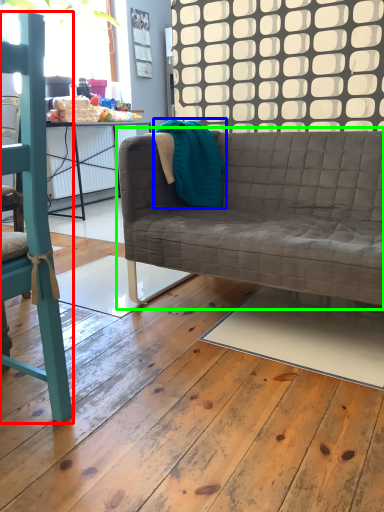
Question: Which is farther away from chair (highlighted by a red box)? material (highlighted by a blue box) or studio couch (highlighted by a green box)?

Choices:
 (A) material
 (B) studio couch

Answer: (A)